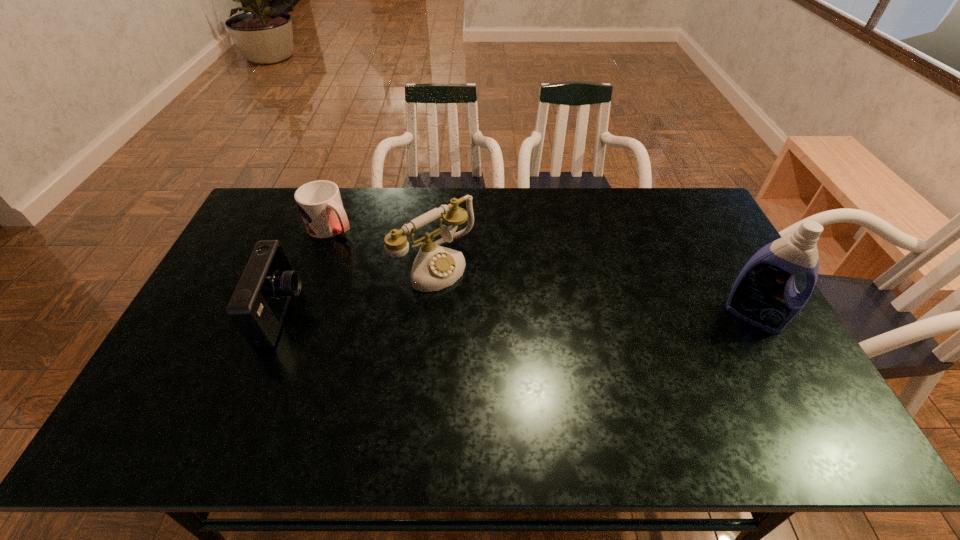
The width and height of the screenshot is (960, 540). In order to click on the third tallest object in this screenshot , I will do `click(257, 308)`.

Image resolution: width=960 pixels, height=540 pixels. In order to click on the rightmost object in this screenshot , I will do `click(764, 294)`.

This screenshot has height=540, width=960. Identify the location of the tallest object. (764, 294).

Locate an element on the screen. Image resolution: width=960 pixels, height=540 pixels. telephone is located at coordinates (435, 267).

The width and height of the screenshot is (960, 540). What are the coordinates of `the third object from left to right` in the screenshot? It's located at (435, 267).

The height and width of the screenshot is (540, 960). Identify the location of mug. (319, 202).

Image resolution: width=960 pixels, height=540 pixels. I want to click on vacant space located on the front-facing side of the third tallest object, so 366,313.

Identify the location of vacant space located 0.270m on the left of the tallest object. (631, 315).

The image size is (960, 540). Identify the location of free space located on the dial of the telephone. (559, 366).

Locate an element on the screen. The height and width of the screenshot is (540, 960). vacant space located 0.140m on the dial of the telephone is located at coordinates coord(492,311).